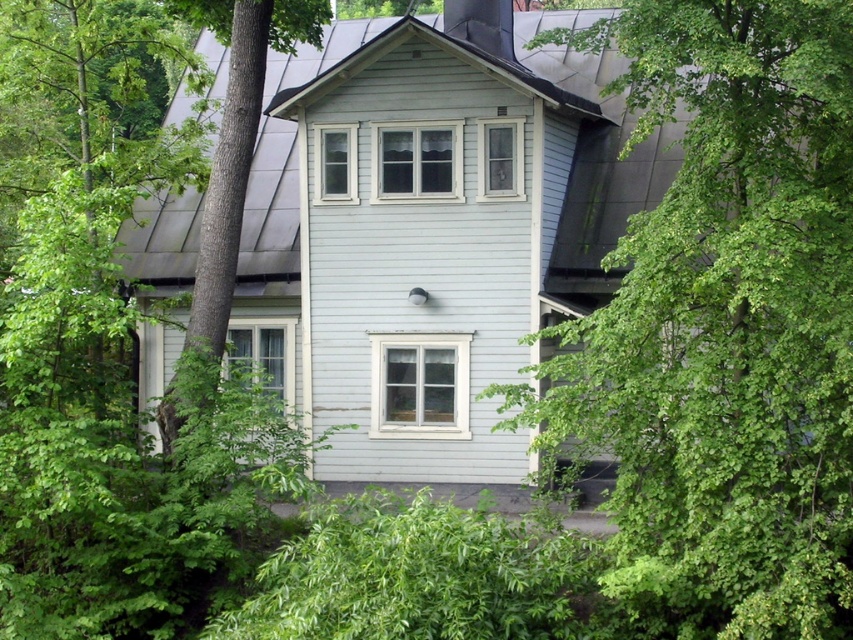
You are a gardener assessing the trees around the house. Which tree, the green leafy tree at center or the green leafy tree at left, has a wider spread?

The green leafy tree at center has a wider spread than the green leafy tree at left.

You are standing in front of the house and notice two points marked on the image. The first point is at coordinates point (808, 291) and the second is at point (251, 68). Which point is closer to you?

Point (808, 291) is closer to the viewer than point (251, 68).

You are a gardener planning to install a new sprinkler system between the green leafy tree at center and the green leafy tree at left. The sprinkler requires a minimum distance of 10 meters between the two trees to function properly. Based on the scene, will the sprinkler work effectively between these two trees?

The green leafy tree at center and green leafy tree at left are 11.73 meters apart from each other. Since the required minimum distance is 10 meters, the sprinkler will work effectively between these two trees as the distance meets the requirement.